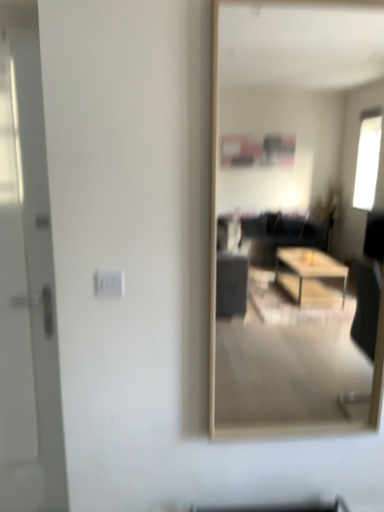
Question: Is white glossy door at left behind white plastic electric outlet at center?

Choices:
 (A) no
 (B) yes

Answer: (A)

Question: From the image's perspective, does white glossy door at left appear lower than white plastic electric outlet at center?

Choices:
 (A) yes
 (B) no

Answer: (A)

Question: Is white glossy door at left completely or partially outside of white plastic electric outlet at center?

Choices:
 (A) no
 (B) yes

Answer: (B)

Question: Can you confirm if white glossy door at left is thinner than white plastic electric outlet at center?

Choices:
 (A) no
 (B) yes

Answer: (A)

Question: Is white glossy door at left at the right side of white plastic electric outlet at center?

Choices:
 (A) no
 (B) yes

Answer: (A)

Question: Is white glossy door at left oriented away from white plastic electric outlet at center?

Choices:
 (A) yes
 (B) no

Answer: (B)

Question: Would you say white glossy door at left is part of white plastic electric outlet at center's contents?

Choices:
 (A) yes
 (B) no

Answer: (B)

Question: Considering the relative positions of white plastic electric outlet at center and white glossy door at left in the image provided, is white plastic electric outlet at center behind white glossy door at left?

Choices:
 (A) yes
 (B) no

Answer: (A)

Question: Considering the relative sizes of white plastic electric outlet at center and white glossy door at left in the image provided, is white plastic electric outlet at center taller than white glossy door at left?

Choices:
 (A) no
 (B) yes

Answer: (A)

Question: Can you confirm if white plastic electric outlet at center is positioned to the right of white glossy door at left?

Choices:
 (A) yes
 (B) no

Answer: (A)

Question: Is white plastic electric outlet at center placed right next to white glossy door at left?

Choices:
 (A) no
 (B) yes

Answer: (A)

Question: Can you confirm if white plastic electric outlet at center is thinner than white glossy door at left?

Choices:
 (A) no
 (B) yes

Answer: (B)

Question: Is white glossy door at left bigger than transparent glass mirror at center?

Choices:
 (A) yes
 (B) no

Answer: (B)